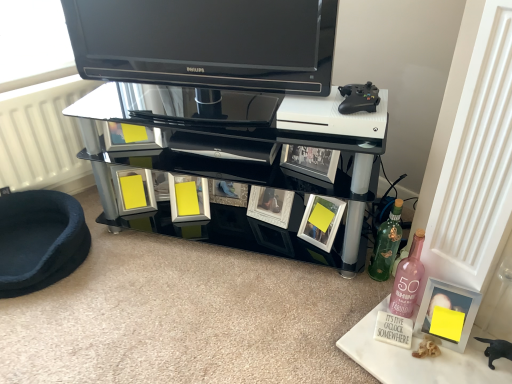
Question: Can you confirm if white glossy picture frame at lower center, placed as the 2th picture frame when sorted from right to left, is thinner than pink glass bottle at lower right, the second bottle when ordered from back to front?

Choices:
 (A) yes
 (B) no

Answer: (B)

Question: Is white glossy picture frame at lower center, the 1th picture frame in the top-to-bottom sequence, touching pink glass bottle at lower right, which appears as the first bottle when viewed from the front?

Choices:
 (A) no
 (B) yes

Answer: (A)

Question: From a real-world perspective, is white glossy picture frame at lower center, the 1th picture frame positioned from the left, below pink glass bottle at lower right, which appears as the first bottle when viewed from the front?

Choices:
 (A) yes
 (B) no

Answer: (A)

Question: Can you confirm if white glossy picture frame at lower center, placed as the 2th picture frame when sorted from bottom to top, is bigger than pink glass bottle at lower right, which appears as the first bottle when viewed from the front?

Choices:
 (A) no
 (B) yes

Answer: (A)

Question: Is white glossy picture frame at lower center, marked as the second picture frame in a front-to-back arrangement, not close to pink glass bottle at lower right, the second bottle when ordered from back to front?

Choices:
 (A) no
 (B) yes

Answer: (A)

Question: Is dark blue plush pet bed at lower left taller or shorter than matte silver picture frame at lower right, which is the 2th picture frame in left-to-right order?

Choices:
 (A) tall
 (B) short

Answer: (B)

Question: Considering the positions of point (28, 193) and point (445, 299), is point (28, 193) closer or farther from the camera than point (445, 299)?

Choices:
 (A) farther
 (B) closer

Answer: (A)

Question: From the image's perspective, relative to matte silver picture frame at lower right, which is the 2th picture frame from back to front, is dark blue plush pet bed at lower left above or below?

Choices:
 (A) below
 (B) above

Answer: (B)

Question: From a real-world perspective, relative to matte silver picture frame at lower right, arranged as the first picture frame when viewed from the front, is dark blue plush pet bed at lower left vertically above or below?

Choices:
 (A) above
 (B) below

Answer: (B)

Question: From a real-world perspective, is black glossy television at upper center positioned above or below white glossy picture frame at lower center, acting as the first picture frame starting from the back?

Choices:
 (A) above
 (B) below

Answer: (A)

Question: From the image's perspective, is black glossy television at upper center positioned above or below white glossy picture frame at lower center, marked as the second picture frame in a front-to-back arrangement?

Choices:
 (A) above
 (B) below

Answer: (A)

Question: Is black glossy television at upper center in front of or behind white glossy picture frame at lower center, acting as the first picture frame starting from the back, in the image?

Choices:
 (A) front
 (B) behind

Answer: (A)

Question: Is point (125, 77) closer or farther from the camera than point (314, 241)?

Choices:
 (A) farther
 (B) closer

Answer: (A)

Question: Which is correct: pink glass bottle at lower right, which appears as the first bottle when viewed from the front, is inside black glossy television at upper center, or outside of it?

Choices:
 (A) outside
 (B) inside

Answer: (A)

Question: From a real-world perspective, is pink glass bottle at lower right, the second bottle when ordered from back to front, physically located above or below black glossy television at upper center?

Choices:
 (A) above
 (B) below

Answer: (B)